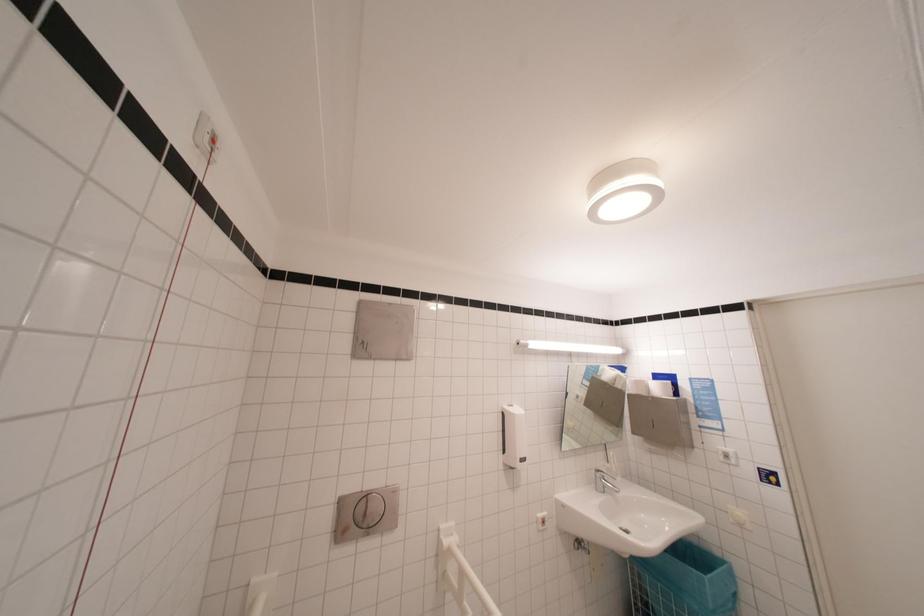
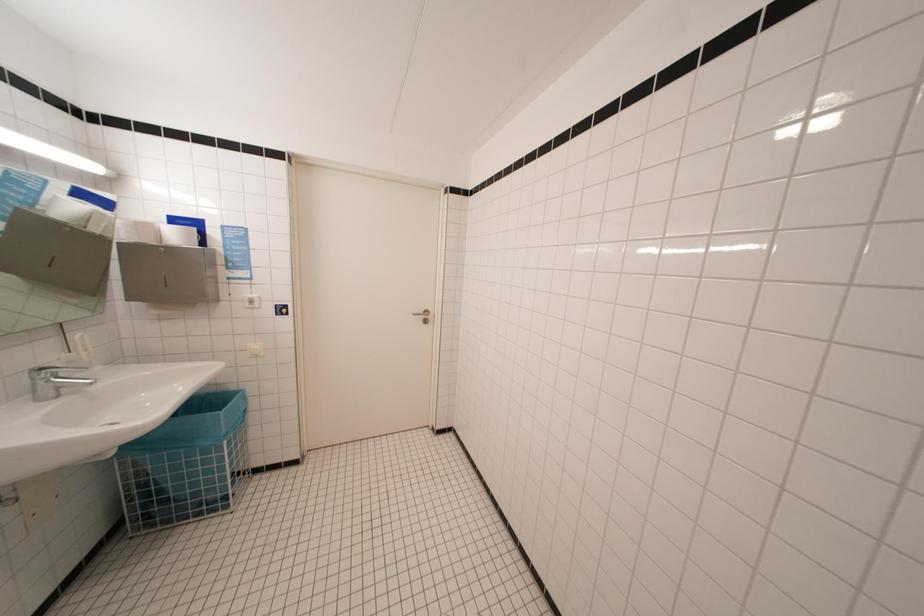
Question: The images are taken continuously from a first-person perspective. In which direction is your viewpoint rotating?

Choices:
 (A) Left
 (B) Right
 (C) Up
 (D) Down

Answer: (B)